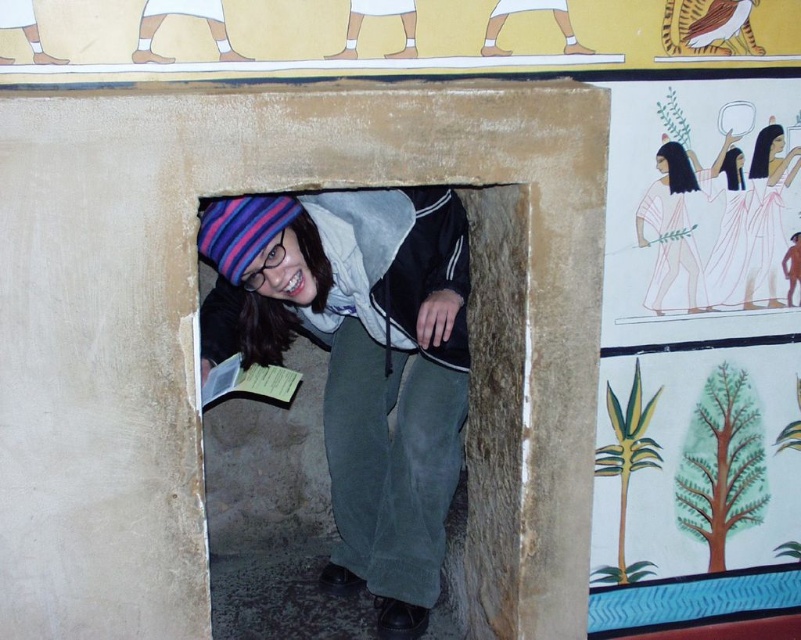
Can you confirm if smooth stone hole at center is wider than smooth white dress at upper right?

Yes.

Does smooth stone hole at center have a lesser height compared to smooth white dress at upper right?

No.

Who is more distant from viewer, (429,529) or (747,292)?

The point (429,529) is more distant.

Find the location of a particular element. This screenshot has width=801, height=640. smooth stone hole at center is located at coordinates (360, 362).